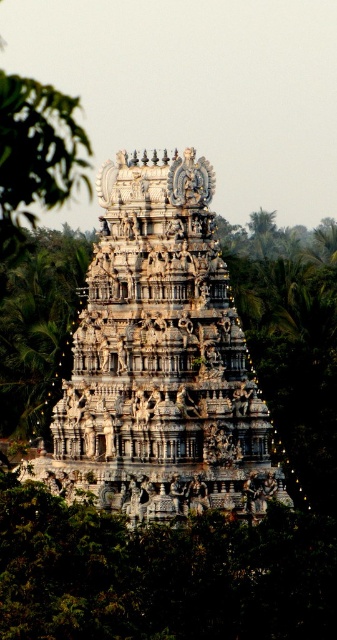
Can you confirm if white stone hindu temple at center is shorter than green leafy tree at center?

No, white stone hindu temple at center is not shorter than green leafy tree at center.

Which is behind, point (166, 234) or point (44, 324)?

The point (44, 324) is more distant.

The image size is (337, 640). What do you see at coordinates (160, 360) in the screenshot? I see `white stone hindu temple at center` at bounding box center [160, 360].

Identify the location of white stone hindu temple at center. This screenshot has height=640, width=337. (160, 360).

Does white stone hindu temple at center have a larger size compared to green leafy tree at left?

No.

Between point (164, 202) and point (43, 172), which one is positioned in front?

Positioned in front is point (43, 172).

The width and height of the screenshot is (337, 640). Find the location of `white stone hindu temple at center`. white stone hindu temple at center is located at coordinates (160, 360).

At what (x,y) coordinates should I click in order to perform the action: click on white stone hindu temple at center. Please return your answer as a coordinate pair (x, y). Looking at the image, I should click on (160, 360).

Can you confirm if green leafy tree at center is positioned below green leafy tree at left?

Yes, green leafy tree at center is below green leafy tree at left.

Image resolution: width=337 pixels, height=640 pixels. What are the coordinates of `green leafy tree at center` in the screenshot? It's located at (39, 326).

Is point (44, 400) positioned after point (34, 202)?

Yes, it is.

Identify the location of green leafy tree at center. The width and height of the screenshot is (337, 640). (39, 326).